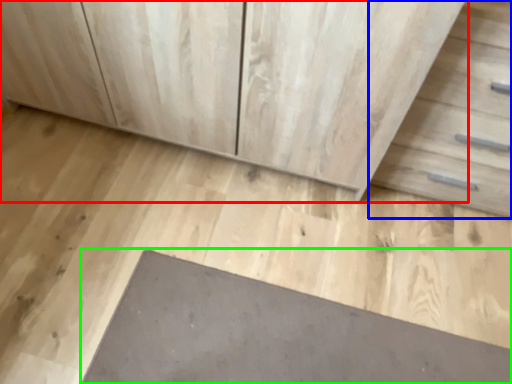
Question: Which object is positioned farthest from chest of drawers (highlighted by a red box)? Select from drawer (highlighted by a blue box) and slate (highlighted by a green box).

Choices:
 (A) drawer
 (B) slate

Answer: (B)